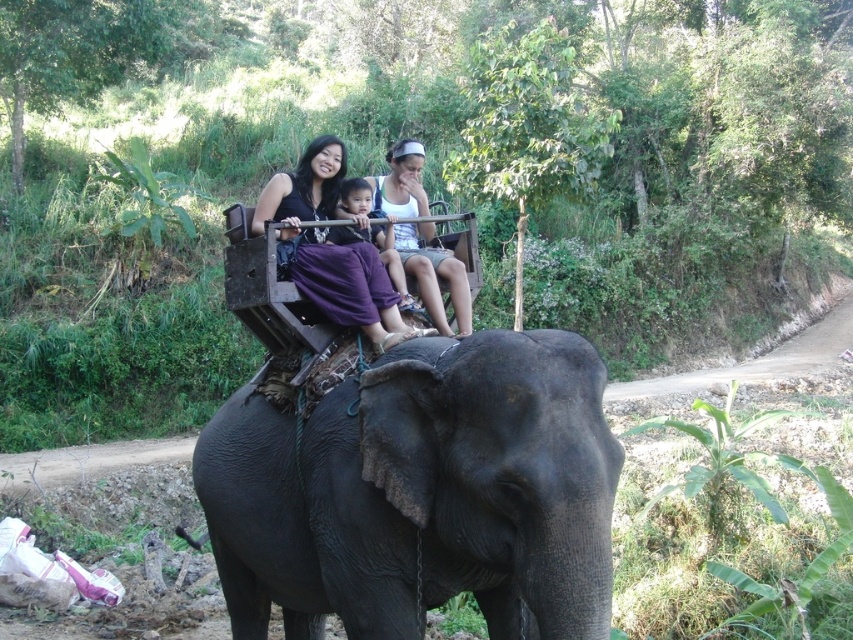
Based on the scene description, where is the matte purple skirt at center located in terms of coordinates?

The matte purple skirt at center is located at coordinates point (331, 248).

You are standing at the origin point in the image. The dark gray textured elephant at center is located at coordinates 0.772 on the x axis and 0.495 on the y axis. If you want to move towards the elephant, which direction should you move along the x and y axes?

To move towards the dark gray textured elephant at center located at coordinates x 0.772 and y 0.495 from the origin, you should move in the positive x direction and the positive y direction since the elephant is in the upper right quadrant relative to your starting position.

In the scene shown: You are a photographer positioned to the left of the scene. You want to capture a photo where the dark gray textured elephant at center and the matte purple skirt at center are both visible. Which object should you adjust your camera angle to focus on first to ensure both are in frame?

The dark gray textured elephant at center is to the right of the matte purple skirt at center. To ensure both are in frame, adjust your camera angle to focus on the matte purple skirt at center first, then pan slightly to the right to include the dark gray textured elephant at center.